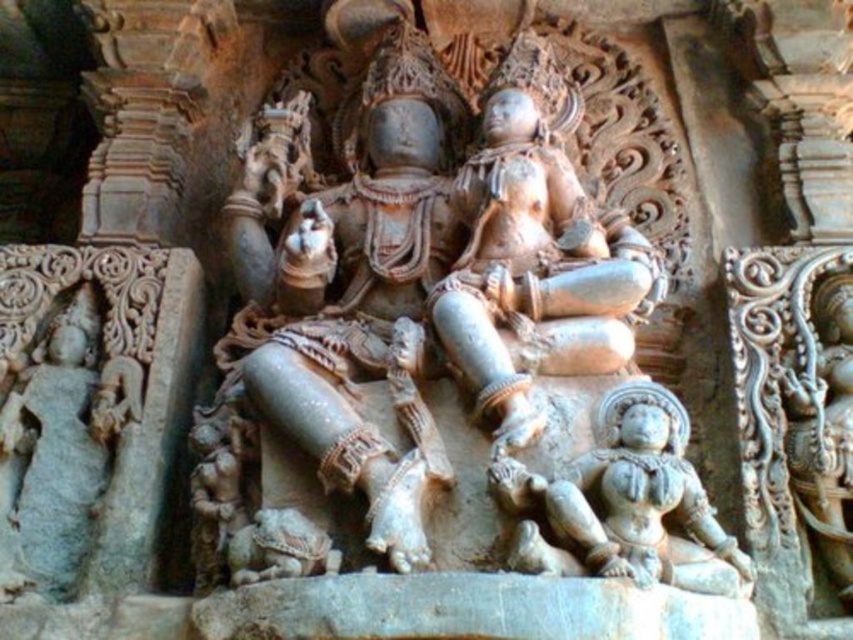
Question: Does smooth stone statue at center appear over gray stone statue at left?

Choices:
 (A) no
 (B) yes

Answer: (B)

Question: Which point is closer to the camera?

Choices:
 (A) (39, 444)
 (B) (520, 372)
 (C) (358, 419)

Answer: (C)

Question: Which object is farther from the camera taking this photo?

Choices:
 (A) smooth stone statue at center
 (B) gray stone statue at left
 (C) gray stone statue at center

Answer: (B)

Question: Can you confirm if gray stone statue at center is positioned below smooth stone statue at center?

Choices:
 (A) yes
 (B) no

Answer: (A)

Question: Does gray stone statue at center have a smaller size compared to gray stone statue at left?

Choices:
 (A) no
 (B) yes

Answer: (B)

Question: Which of these objects is positioned farthest from the gray stone statue at left?

Choices:
 (A) gray stone statue at center
 (B) smooth stone statue at center

Answer: (B)